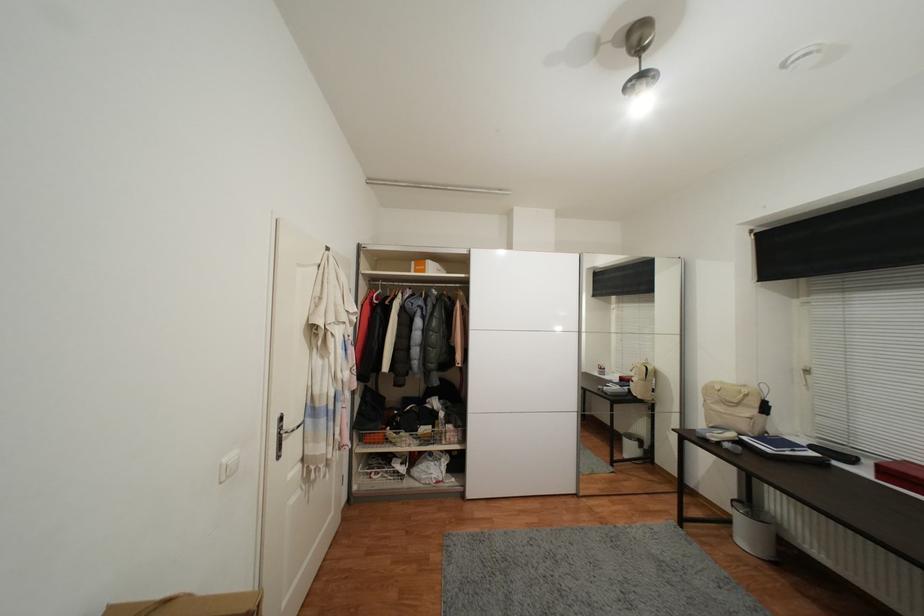
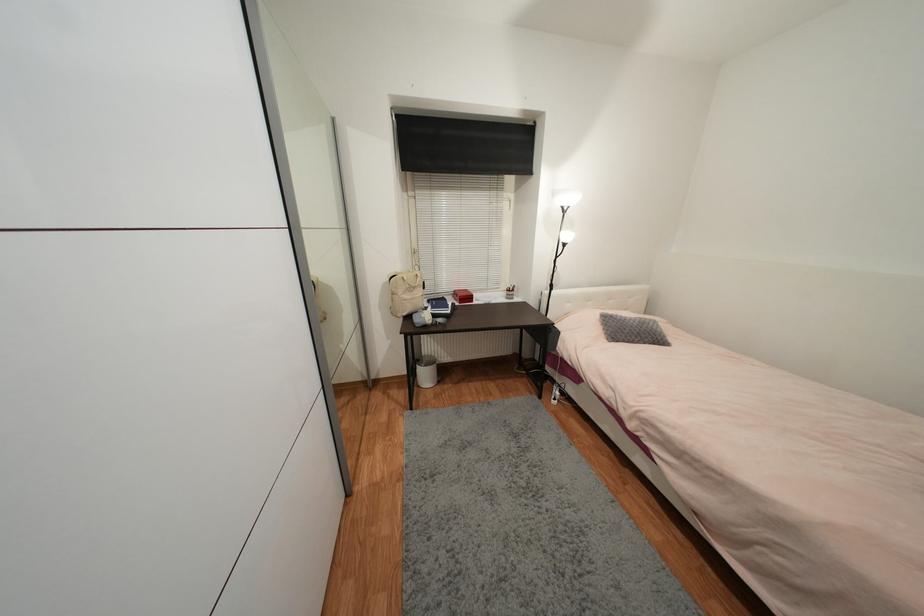
The point at (748, 387) is marked in the first image. Where is the corresponding point in the second image?

(412, 273)